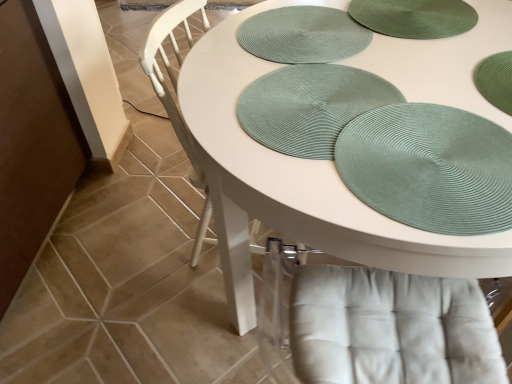
Image resolution: width=512 pixels, height=384 pixels. I want to click on free space in front of green textured placemat at upper center, placed as the 1th platter when sorted from back to front, so click(320, 101).